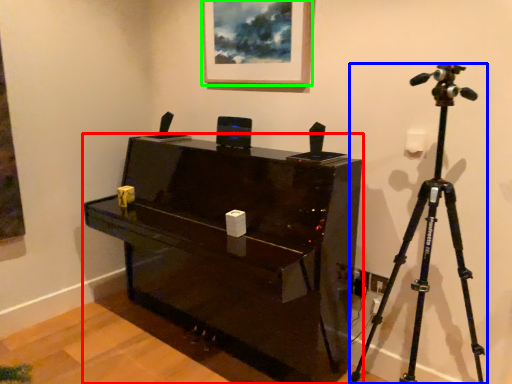
Question: Estimate the real-world distances between objects in this image. Which object is farther from furniture (highlighted by a red box), tripod (highlighted by a blue box) or picture frame (highlighted by a green box)?

Choices:
 (A) tripod
 (B) picture frame

Answer: (B)